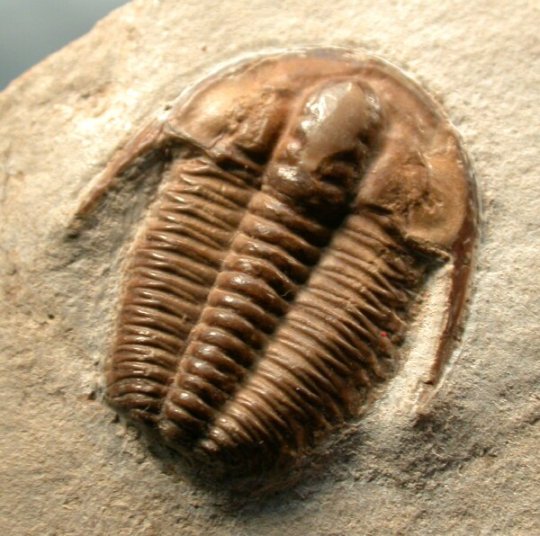
You are a GUI agent. You are given a task and a screenshot of the screen. Output one action in this format:
    pyautogui.click(x=<x>, y=<y>)
    Task: Click on the wall
    This screenshot has height=536, width=540.
    Given the screenshot: What is the action you would take?
    pyautogui.click(x=11, y=32)